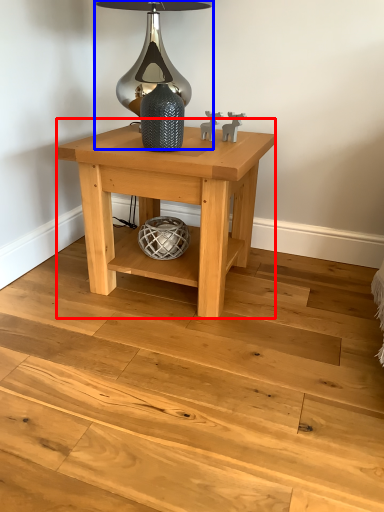
Question: Which of the following is the farthest to the observer, table (highlighted by a red box) or table lamp (highlighted by a blue box)?

Choices:
 (A) table
 (B) table lamp

Answer: (B)